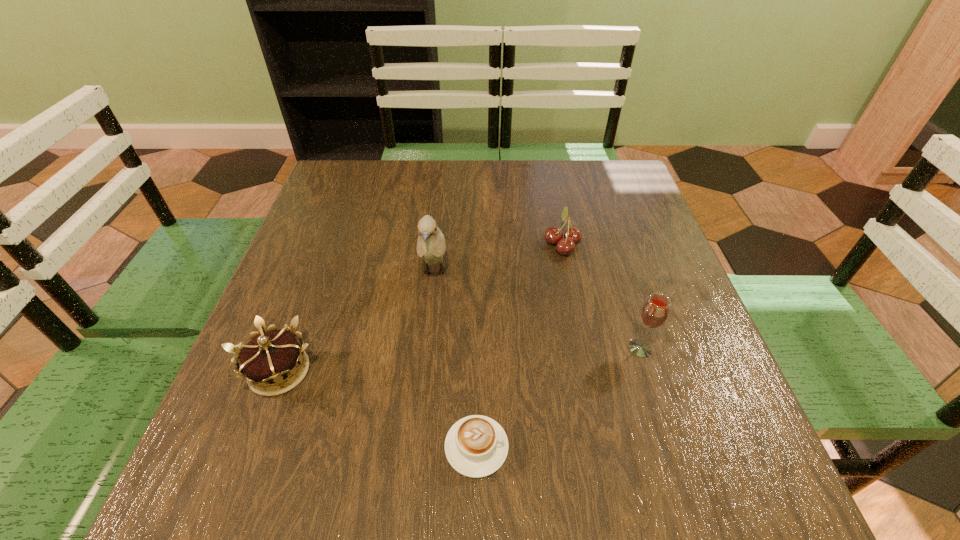
Find the location of a particular element. The width and height of the screenshot is (960, 540). blank region between the second tallest object and the fourth object from right to left is located at coordinates (538, 311).

This screenshot has height=540, width=960. I want to click on free space between the cherry and the fourth object from right to left, so click(x=498, y=259).

This screenshot has width=960, height=540. In order to click on unoccupied area between the rightmost object and the cappuccino in this screenshot , I will do `click(559, 397)`.

Locate an element on the screen. vacant space that's between the fourth shortest object and the crown is located at coordinates (460, 360).

Where is `object that is the fourth nearest to the shortest object`? The height and width of the screenshot is (540, 960). object that is the fourth nearest to the shortest object is located at coordinates (553, 235).

Locate which object is the second closest to the second tallest object. Please provide its 2D coordinates. Your answer should be formatted as a tuple, i.e. [(x, y)], where the tuple contains the x and y coordinates of a point satisfying the conditions above.

[(476, 446)]

At what (x,y) coordinates should I click in order to perform the action: click on vacant area that satisfies the following two spatial constraints: 1. on the back side of the leftmost object; 2. on the right side of the second tallest object. Please return your answer as a coordinate pair (x, y). Image resolution: width=960 pixels, height=540 pixels. Looking at the image, I should click on [x=288, y=348].

This screenshot has width=960, height=540. Identify the location of vacant position in the image that satisfies the following two spatial constraints: 1. on the leaves of the rightmost object; 2. on the right side of the fourth object from left to right. (584, 348).